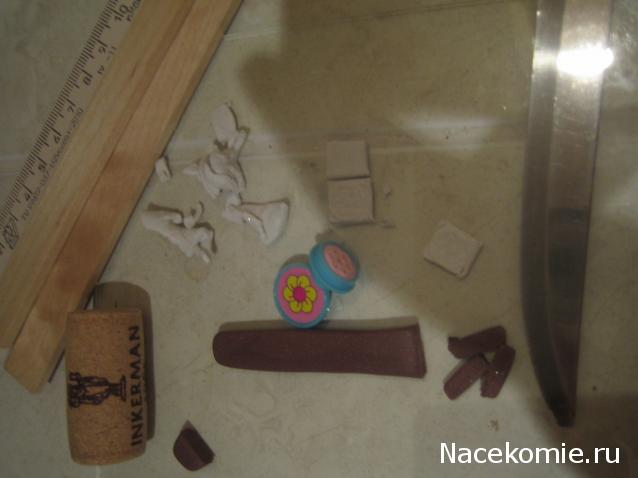
Where is `white surface`? This screenshot has height=478, width=638. white surface is located at coordinates (420, 207).